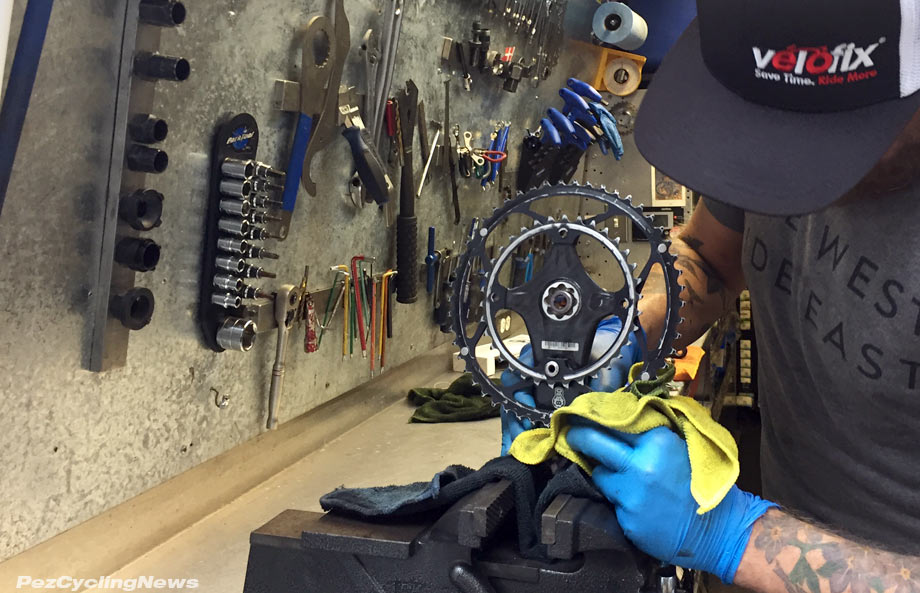
Image resolution: width=920 pixels, height=593 pixels. In order to click on white wall in this screenshot , I will do `click(40, 382)`.